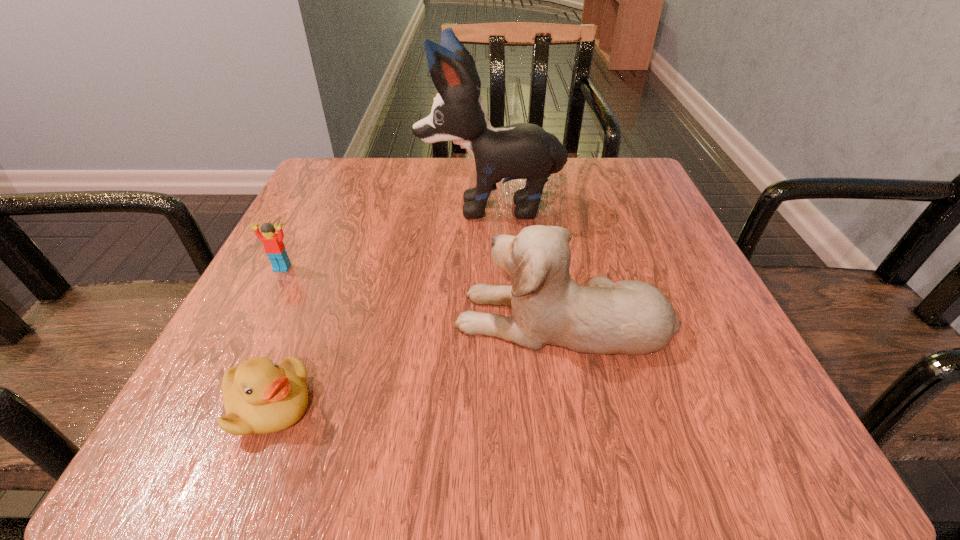
Identify the location of free spot at the far edge of the desktop. This screenshot has height=540, width=960. (558, 209).

I want to click on free spot at the near edge of the desktop, so click(x=359, y=400).

In the image, there is a desktop. At what (x,y) coordinates should I click in order to perform the action: click on vacant space at the left edge. Please return your answer as a coordinate pair (x, y). This screenshot has width=960, height=540. Looking at the image, I should click on pyautogui.click(x=353, y=257).

At what (x,y) coordinates should I click in order to perform the action: click on free region at the right edge of the desktop. Please return your answer as a coordinate pair (x, y). The width and height of the screenshot is (960, 540). Looking at the image, I should click on (645, 373).

In the image, there is a desktop. Find the location of `vacant space at the far left corner`. vacant space at the far left corner is located at coordinates (374, 216).

In the image, there is a desktop. Identify the location of vacant area at the near left corner. (185, 434).

Locate an element on the screen. This screenshot has width=960, height=540. vacant space at the far right corner is located at coordinates (631, 202).

Find the location of a particular element. vacant space in between the shorter puppy and the nearest object is located at coordinates (417, 362).

You are a GUI agent. You are given a task and a screenshot of the screen. Output one action in this format:
    pyautogui.click(x=<x>, y=<y>)
    Task: Click on the vacant area that lies between the nearest object and the nearer puppy
    
    Given the screenshot: What is the action you would take?
    pyautogui.click(x=417, y=362)

Where is `free point between the Lego and the farthest object`? The height and width of the screenshot is (540, 960). free point between the Lego and the farthest object is located at coordinates (387, 237).